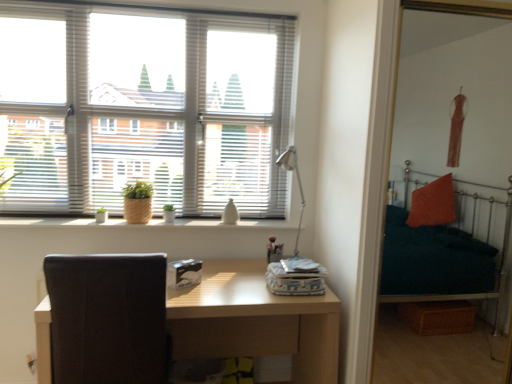
What are the coordinates of `blank space above white blinds at upper left (from a real-world perspective)` in the screenshot? It's located at (152, 4).